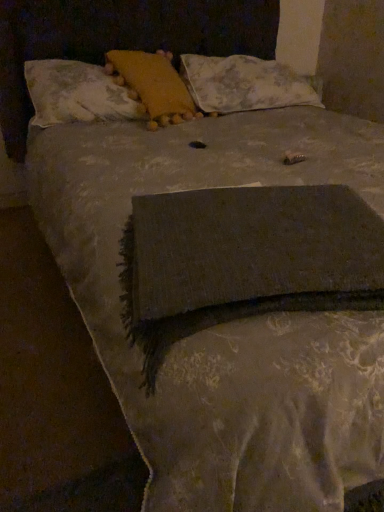
Question: Can you confirm if fluffy white pillow at upper center, acting as the 3th pillow starting from the right, is taller than floral fabric pillow at upper center, placed as the 1th pillow when sorted from right to left?

Choices:
 (A) yes
 (B) no

Answer: (B)

Question: From a real-world perspective, is fluffy white pillow at upper center, acting as the first pillow starting from the left, located higher than floral fabric pillow at upper center, placed as the 1th pillow when sorted from right to left?

Choices:
 (A) no
 (B) yes

Answer: (B)

Question: From a real-world perspective, is fluffy white pillow at upper center, acting as the first pillow starting from the left, beneath floral fabric pillow at upper center, placed as the 1th pillow when sorted from right to left?

Choices:
 (A) yes
 (B) no

Answer: (B)

Question: Is fluffy white pillow at upper center, acting as the 3th pillow starting from the right, facing towards floral fabric pillow at upper center, which appears as the 3th pillow when viewed from the left?

Choices:
 (A) yes
 (B) no

Answer: (B)

Question: Can you confirm if fluffy white pillow at upper center, acting as the first pillow starting from the left, is positioned to the right of floral fabric pillow at upper center, which appears as the 3th pillow when viewed from the left?

Choices:
 (A) no
 (B) yes

Answer: (A)

Question: From the image's perspective, relative to fluffy white pillow at upper center, acting as the first pillow starting from the left, is floral fabric pillow at upper center, which appears as the 3th pillow when viewed from the left, above or below?

Choices:
 (A) above
 (B) below

Answer: (A)

Question: Considering the positions of point (205, 108) and point (81, 102), is point (205, 108) closer or farther from the camera than point (81, 102)?

Choices:
 (A) farther
 (B) closer

Answer: (A)

Question: In the image, is floral fabric pillow at upper center, which appears as the 3th pillow when viewed from the left, positioned in front of or behind fluffy white pillow at upper center, acting as the first pillow starting from the left?

Choices:
 (A) front
 (B) behind

Answer: (B)

Question: From a real-world perspective, is floral fabric pillow at upper center, placed as the 1th pillow when sorted from right to left, above or below fluffy white pillow at upper center, acting as the first pillow starting from the left?

Choices:
 (A) below
 (B) above

Answer: (A)

Question: Is fluffy white pillow at upper center, acting as the 3th pillow starting from the right, wider or thinner than floral fabric pillow at upper center, placed as the 1th pillow when sorted from right to left?

Choices:
 (A) thin
 (B) wide

Answer: (A)

Question: From their relative heights in the image, would you say fluffy white pillow at upper center, acting as the first pillow starting from the left, is taller or shorter than floral fabric pillow at upper center, which appears as the 3th pillow when viewed from the left?

Choices:
 (A) short
 (B) tall

Answer: (A)

Question: Would you say fluffy white pillow at upper center, acting as the first pillow starting from the left, is to the left or to the right of floral fabric pillow at upper center, which appears as the 3th pillow when viewed from the left, in the picture?

Choices:
 (A) right
 (B) left

Answer: (B)

Question: Is point (34, 95) closer or farther from the camera than point (266, 64)?

Choices:
 (A) farther
 (B) closer

Answer: (B)

Question: Based on their positions, is yellow fabric pillow at upper center, the second pillow viewed from the left, located to the left or right of floral fabric pillow at upper center, which appears as the 3th pillow when viewed from the left?

Choices:
 (A) left
 (B) right

Answer: (A)

Question: Considering the positions of point (152, 113) and point (198, 80), is point (152, 113) closer or farther from the camera than point (198, 80)?

Choices:
 (A) closer
 (B) farther

Answer: (A)